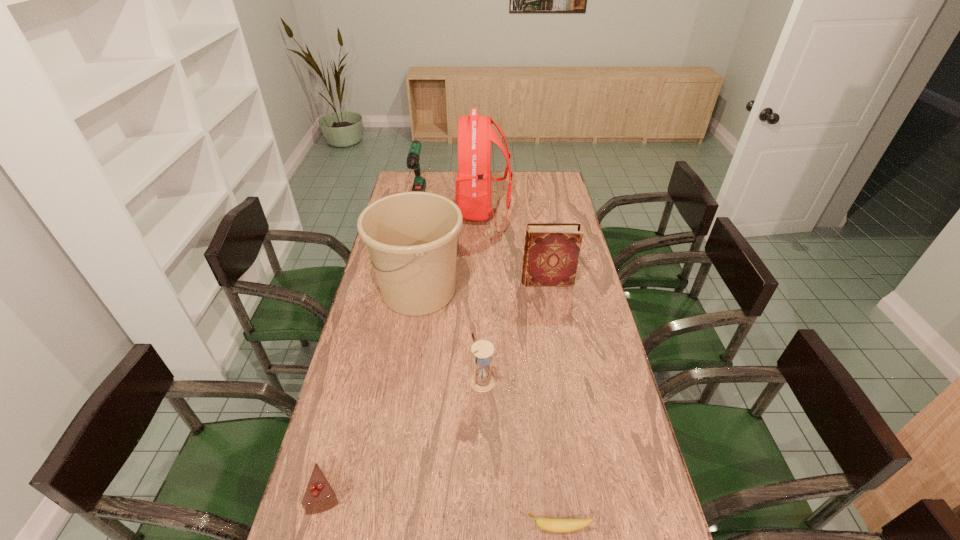
The width and height of the screenshot is (960, 540). In the image, there is a desktop. What are the coordinates of `vacant space at the right edge` in the screenshot? It's located at (625, 474).

This screenshot has width=960, height=540. In order to click on free space between the hardback book and the nearest object in this screenshot , I will do `click(553, 404)`.

Where is `vacant area that lies between the backpack and the hourglass`? vacant area that lies between the backpack and the hourglass is located at coordinates point(483,296).

Find the location of a particular element. This screenshot has height=540, width=960. vacant space that's between the hardback book and the bucket is located at coordinates (483, 286).

At what (x,y) coordinates should I click in order to perform the action: click on vacant space in between the hourglass and the tallest object. Please return your answer as a coordinate pair (x, y). This screenshot has width=960, height=540. Looking at the image, I should click on (483, 296).

I want to click on free space that is in between the third nearest object and the second nearest object, so click(405, 437).

Where is `free area in between the drill and the hardback book`? The image size is (960, 540). free area in between the drill and the hardback book is located at coordinates (483, 240).

The height and width of the screenshot is (540, 960). I want to click on object that is the second closest to the hourglass, so click(x=553, y=525).

Identify the location of object that can be found as the fourth closest to the third shortest object. The image size is (960, 540). [x=551, y=252].

The height and width of the screenshot is (540, 960). Identify the location of free point that satisfies the following two spatial constraints: 1. on the handle side of the drill; 2. on the right side of the sixth shortest object. (399, 292).